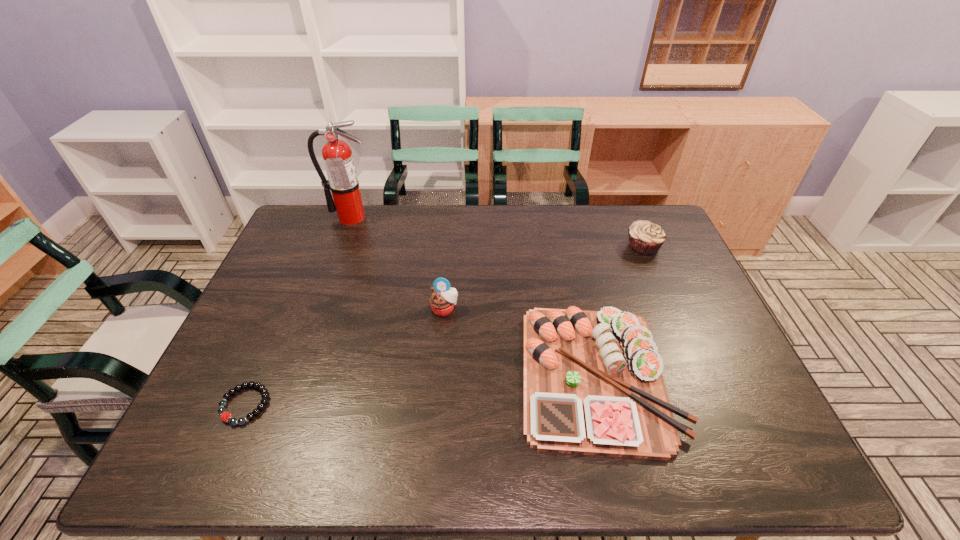
At what (x,y) coordinates should I click in order to perform the action: click on object present at the far right corner. Please return your answer as a coordinate pair (x, y). The height and width of the screenshot is (540, 960). Looking at the image, I should click on (645, 238).

In the image, there is a desktop. In order to click on blank space at the far edge in this screenshot , I will do `click(483, 231)`.

Image resolution: width=960 pixels, height=540 pixels. What are the coordinates of `free region at the left edge of the desktop` in the screenshot? It's located at (245, 354).

This screenshot has width=960, height=540. Find the location of `vacant area at the right edge`. vacant area at the right edge is located at coordinates (644, 280).

Identify the location of vacant position at the far left corner of the desktop. (329, 234).

In order to click on empty space that is in between the bracelet and the fourth tallest object in this screenshot , I will do `click(421, 390)`.

I want to click on free space between the shortest object and the left muffin, so click(x=345, y=357).

Locate an element on the screen. The height and width of the screenshot is (540, 960). free area in between the third object from left to right and the farther muffin is located at coordinates (544, 278).

Where is `empty space that is in between the fire extinguisher and the left muffin`? The image size is (960, 540). empty space that is in between the fire extinguisher and the left muffin is located at coordinates (397, 263).

The width and height of the screenshot is (960, 540). Identify the location of vacant area that lies between the second shortest object and the bracelet. (421, 390).